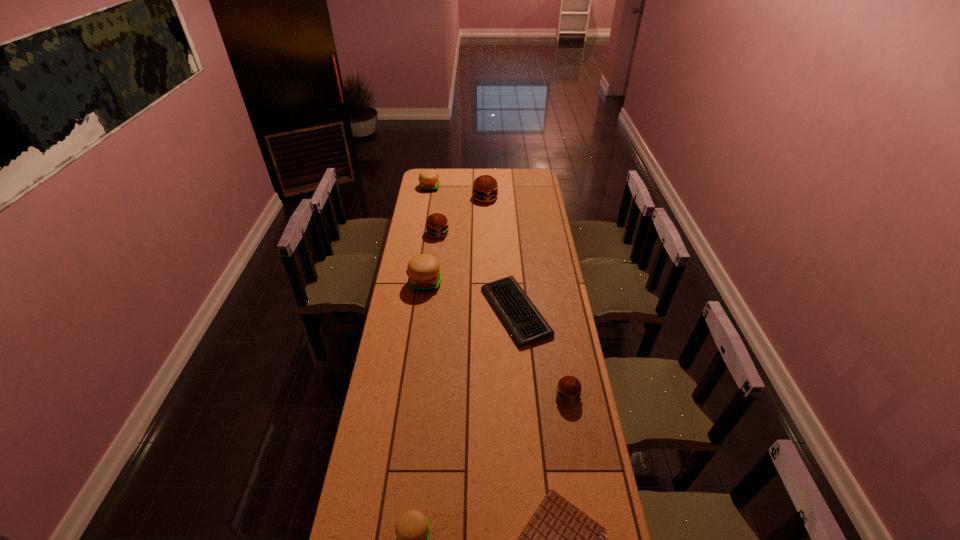
In order to click on object that is the closest one to the smallest beige hamburger in this screenshot , I will do `click(559, 539)`.

You are a GUI agent. You are given a task and a screenshot of the screen. Output one action in this format:
    pyautogui.click(x=<x>, y=<y>)
    Task: Click on the fourth closest object to the seventh tallest object
    This screenshot has height=540, width=960.
    Given the screenshot: What is the action you would take?
    pyautogui.click(x=559, y=539)

Locate which hamburger is the third closest to the rightmost brown hamburger. Please provide its 2D coordinates. Your answer should be formatted as a tuple, i.e. [(x, y)], where the tuple contains the x and y coordinates of a point satisfying the conditions above.

[(437, 225)]

This screenshot has height=540, width=960. Find the location of `the fourth closest hamburger to the second smallest beige hamburger`. the fourth closest hamburger to the second smallest beige hamburger is located at coordinates (568, 389).

The width and height of the screenshot is (960, 540). In order to click on the closest brown hamburger to the shortest object in this screenshot , I will do `click(568, 389)`.

Point out which brown hamburger is positioned as the second nearest to the rightmost hamburger. Please provide its 2D coordinates. Your answer should be formatted as a tuple, i.e. [(x, y)], where the tuple contains the x and y coordinates of a point satisfying the conditions above.

[(485, 188)]

This screenshot has height=540, width=960. I want to click on the second closest beige hamburger to the rightmost hamburger, so click(424, 273).

Locate which beige hamburger is the third closest to the notebook. Please provide its 2D coordinates. Your answer should be formatted as a tuple, i.e. [(x, y)], where the tuple contains the x and y coordinates of a point satisfying the conditions above.

[(428, 178)]

I want to click on free spot that satisfies the following two spatial constraints: 1. on the front side of the second biggest beige hamburger; 2. on the right side of the sixth nearest object, so coord(422,234).